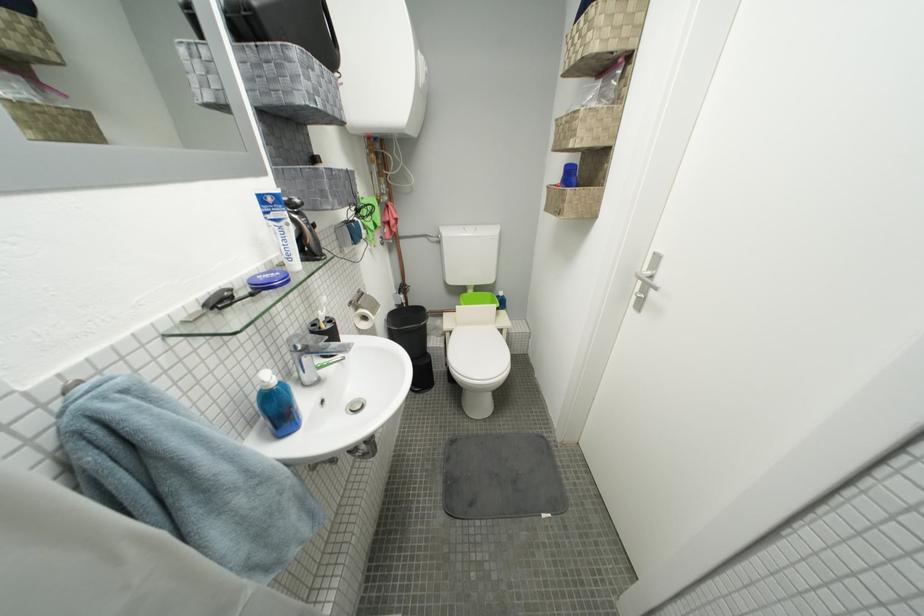
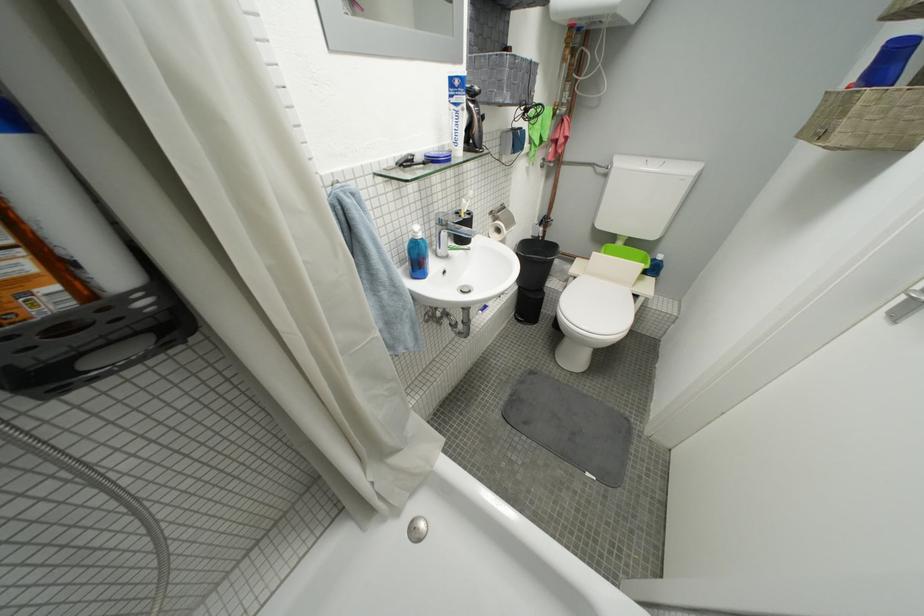
Find the pixel in the second image that matches pixel 305 357 in the first image.

(447, 230)